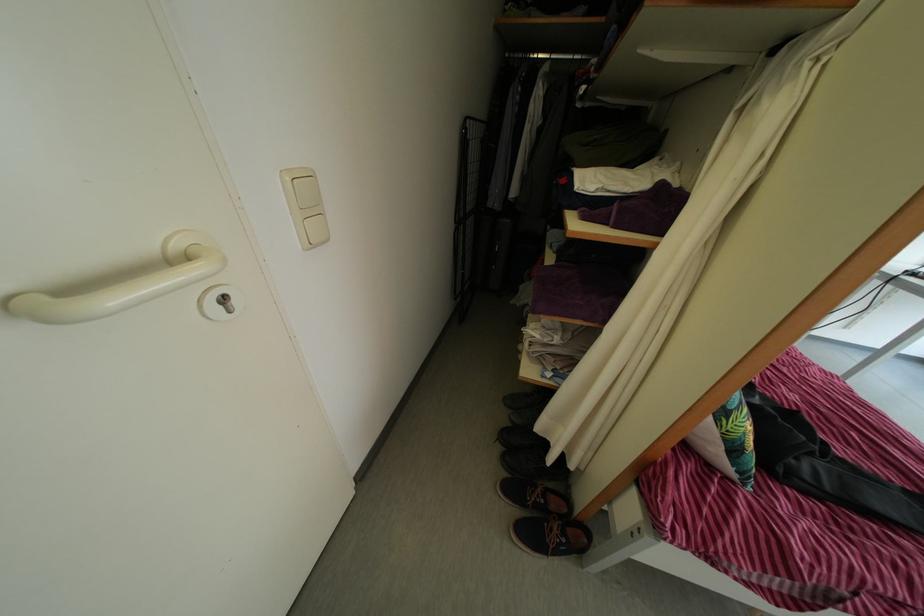
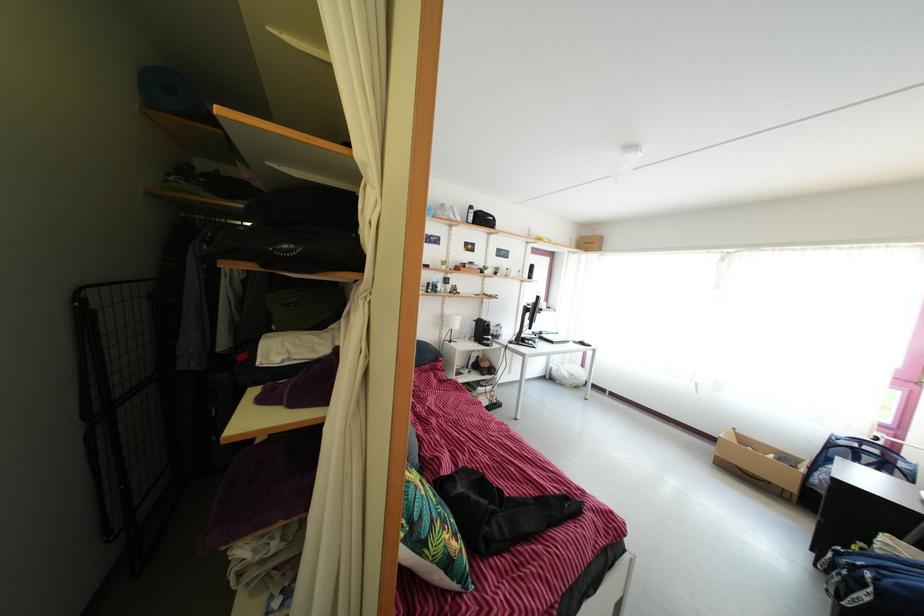
Question: The images are taken continuously from a first-person perspective. In which direction is your viewpoint rotating?

Choices:
 (A) Left
 (B) Right
 (C) Up
 (D) Down

Answer: (B)